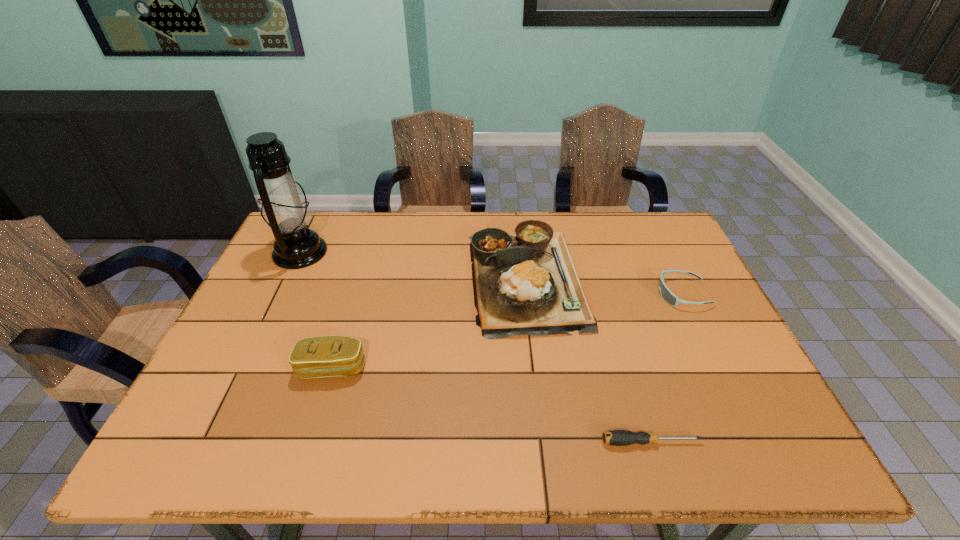
At what (x,y) coordinates should I click in order to perform the action: click on free area in between the platter and the clutch bag. Please return your answer as a coordinate pair (x, y). Looking at the image, I should click on (429, 323).

Image resolution: width=960 pixels, height=540 pixels. Find the location of `vacant space that's between the nearest object and the leftmost object`. vacant space that's between the nearest object and the leftmost object is located at coordinates (475, 347).

You are a GUI agent. You are given a task and a screenshot of the screen. Output one action in this format:
    pyautogui.click(x=<x>, y=<y>)
    Task: Click on the free space between the nearest object and the goggles
    
    Given the screenshot: What is the action you would take?
    pyautogui.click(x=666, y=368)

Identify the location of the closest object to the tallest object. The width and height of the screenshot is (960, 540). (322, 356).

Point out which object is positioned as the nearest to the oil lamp. Please provide its 2D coordinates. Your answer should be formatted as a tuple, i.e. [(x, y)], where the tuple contains the x and y coordinates of a point satisfying the conditions above.

[(322, 356)]

Where is `vacant space that satisfies the following two spatial constraints: 1. on the front side of the nearest object; 2. on the left side of the platter`? vacant space that satisfies the following two spatial constraints: 1. on the front side of the nearest object; 2. on the left side of the platter is located at coordinates (544, 442).

At what (x,y) coordinates should I click in order to perform the action: click on free space that satisfies the following two spatial constraints: 1. on the front-facing side of the rightmost object; 2. on the zipper side of the fourth object from right to left. Please return your answer as a coordinate pair (x, y). Looking at the image, I should click on (718, 368).

At what (x,y) coordinates should I click in order to perform the action: click on free location that satisfies the following two spatial constraints: 1. on the front side of the platter; 2. on the left side of the leftmost object. Please return your answer as a coordinate pair (x, y). Looking at the image, I should click on (287, 279).